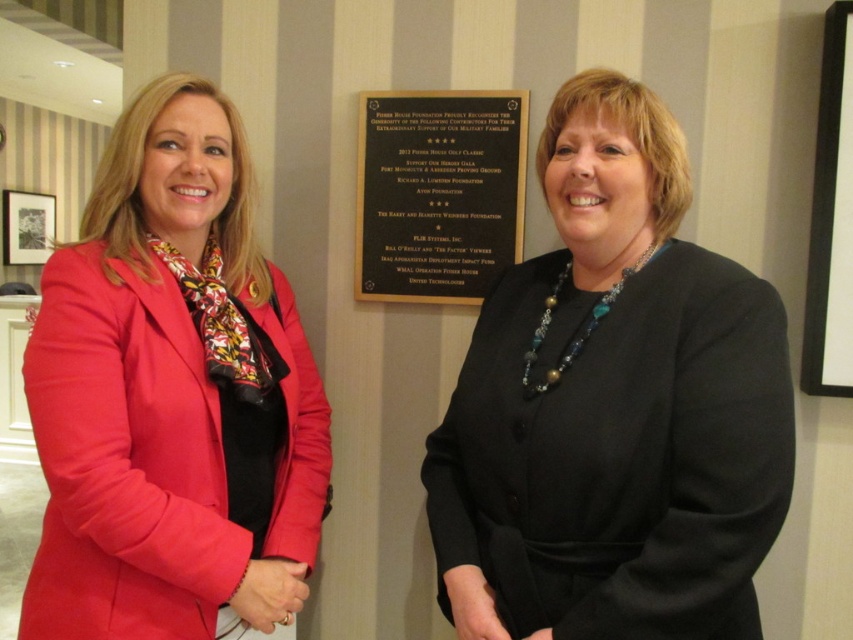
You are an interior designer assessing the wall decorations in a formal setting. The gold metallic plaque at center and the white glossy board at upper right are both on the same wall. Which object takes up more horizontal space on the wall?

The gold metallic plaque at center takes up more horizontal space on the wall because its width is larger than the white glossy board at upper right.

You are an interior designer assessing the placement of the black matte blazer at center in a room with a striped beige and white wall. Based on the coordinates provided, is the blazer closer to the top or bottom of the wall?

The black matte blazer at center is positioned at coordinates point (x=613, y=406). Since the y coordinate is 0.720, which is closer to 1.0 than 0.0, the blazer is closer to the bottom of the wall.

You are a photographer who needs to ensure that the matte pink blazer at left and the gold metallic plaque at center are both visible in your photo. Based on their sizes, which object should you focus on to ensure both are captured clearly?

The matte pink blazer at left is bigger than the gold metallic plaque at center, so you should focus on the matte pink blazer at left to ensure both are visible since it requires more space in the frame.